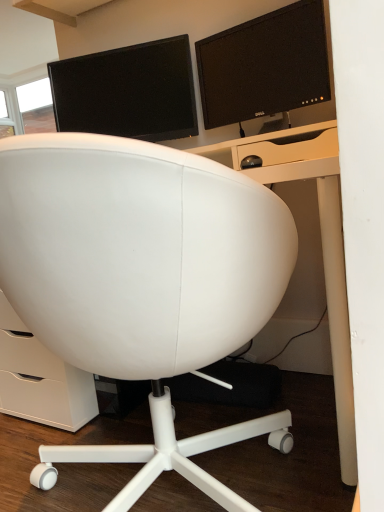
Question: Is matte black monitor at upper center, acting as the second computer monitor starting from the left, completely or partially inside matte black monitor at upper center, which ranks as the second computer monitor in right-to-left order?

Choices:
 (A) no
 (B) yes

Answer: (A)

Question: Can you confirm if matte black monitor at upper center, which ranks as the second computer monitor in right-to-left order, is smaller than matte black monitor at upper center, acting as the second computer monitor starting from the left?

Choices:
 (A) yes
 (B) no

Answer: (B)

Question: Is the position of matte black monitor at upper center, which ranks as the second computer monitor in right-to-left order, less distant than that of matte black monitor at upper center, positioned as the first computer monitor in right-to-left order?

Choices:
 (A) no
 (B) yes

Answer: (A)

Question: Is matte black monitor at upper center, which ranks as the second computer monitor in right-to-left order, wider than matte black monitor at upper center, positioned as the first computer monitor in right-to-left order?

Choices:
 (A) yes
 (B) no

Answer: (A)

Question: Does matte black monitor at upper center, which is counted as the first computer monitor, starting from the left, have a larger size compared to matte black monitor at upper center, positioned as the first computer monitor in right-to-left order?

Choices:
 (A) yes
 (B) no

Answer: (A)

Question: Considering the positions of matte black monitor at upper center, which ranks as the second computer monitor in right-to-left order, and white leather chair at center in the image, is matte black monitor at upper center, which ranks as the second computer monitor in right-to-left order, wider or thinner than white leather chair at center?

Choices:
 (A) thin
 (B) wide

Answer: (A)

Question: Is point (180, 41) positioned closer to the camera than point (276, 284)?

Choices:
 (A) farther
 (B) closer

Answer: (A)

Question: Is matte black monitor at upper center, which ranks as the second computer monitor in right-to-left order, to the left or to the right of white leather chair at center in the image?

Choices:
 (A) right
 (B) left

Answer: (B)

Question: Considering the positions of matte black monitor at upper center, which is counted as the first computer monitor, starting from the left, and white leather chair at center in the image, is matte black monitor at upper center, which is counted as the first computer monitor, starting from the left, bigger or smaller than white leather chair at center?

Choices:
 (A) small
 (B) big

Answer: (A)

Question: Is point (77, 248) closer or farther from the camera than point (253, 95)?

Choices:
 (A) farther
 (B) closer

Answer: (B)

Question: Which is correct: white leather chair at center is inside matte black monitor at upper center, acting as the second computer monitor starting from the left, or outside of it?

Choices:
 (A) inside
 (B) outside

Answer: (B)

Question: Based on their sizes in the image, would you say white leather chair at center is bigger or smaller than matte black monitor at upper center, acting as the second computer monitor starting from the left?

Choices:
 (A) small
 (B) big

Answer: (B)

Question: In terms of width, does white leather chair at center look wider or thinner when compared to matte black monitor at upper center, positioned as the first computer monitor in right-to-left order?

Choices:
 (A) wide
 (B) thin

Answer: (A)

Question: Is white leather chair at center in front of or behind matte black monitor at upper center, which is counted as the first computer monitor, starting from the left, in the image?

Choices:
 (A) behind
 (B) front

Answer: (B)

Question: In terms of height, does white leather chair at center look taller or shorter compared to matte black monitor at upper center, which is counted as the first computer monitor, starting from the left?

Choices:
 (A) short
 (B) tall

Answer: (B)